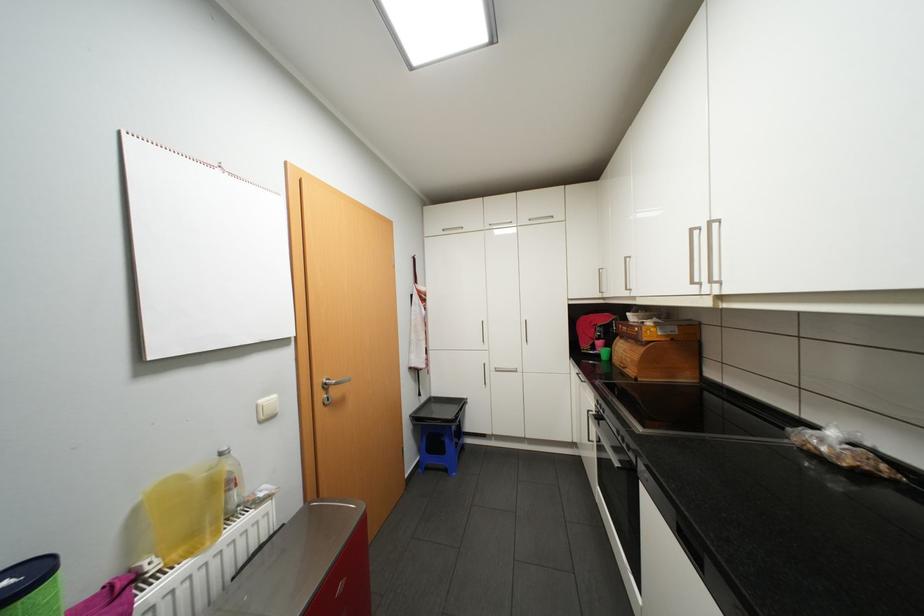
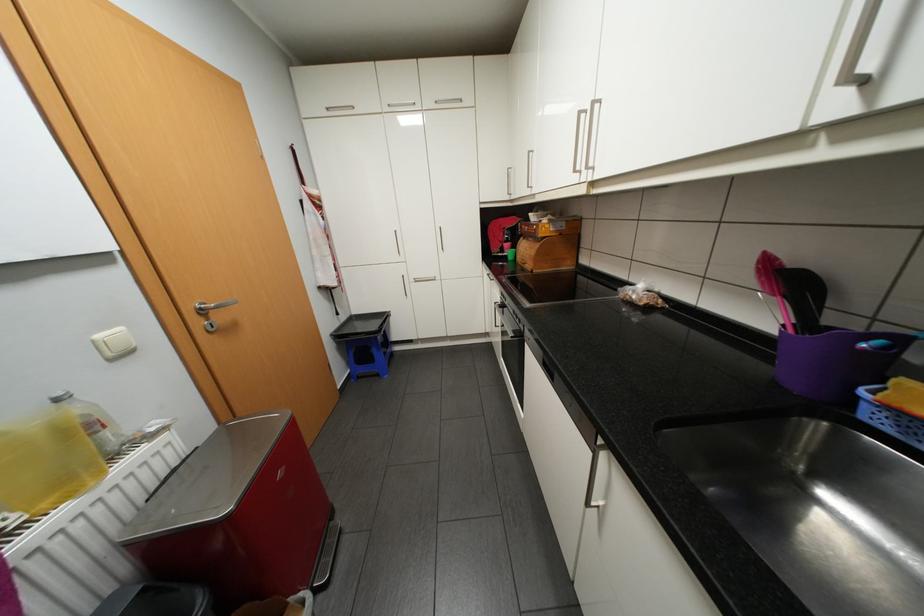
In the second image, find the point that corresponds to pixel 454 469 in the first image.

(385, 374)